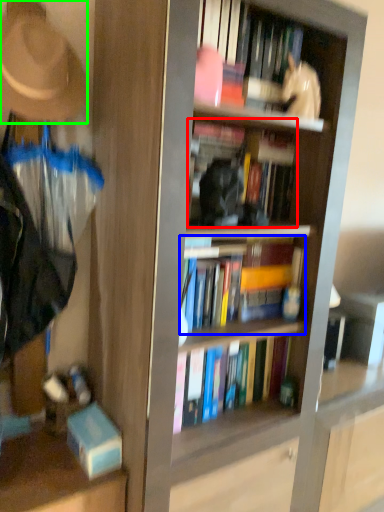
Question: Considering the real-world distances, which object is farthest from book (highlighted by a red box)? book (highlighted by a blue box) or hat (highlighted by a green box)?

Choices:
 (A) book
 (B) hat

Answer: (B)